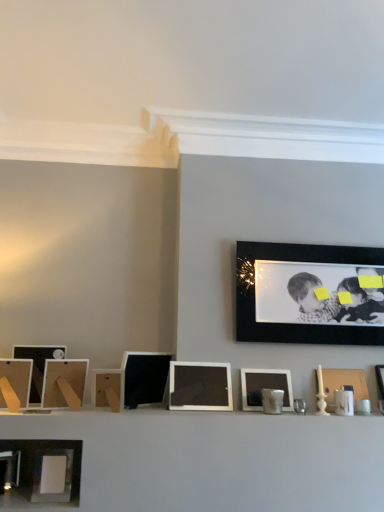
Question: Which direction should I rotate to look at matte black picture frame at center, placed as the 5th picture frame when sorted from left to right, — up or down?

Choices:
 (A) down
 (B) up

Answer: (A)

Question: Should I look upward or downward to see matte black picture frame at left, the 2th picture frame positioned from the left?

Choices:
 (A) up
 (B) down

Answer: (B)

Question: Is wooden picture frame at right, the ninth picture frame positioned from the left, to the right of wooden at center, arranged as the sixth picture frame when viewed from the right, from the viewer's perspective?

Choices:
 (A) yes
 (B) no

Answer: (A)

Question: Considering the relative sizes of wooden picture frame at right, the ninth picture frame positioned from the left, and wooden at center, arranged as the sixth picture frame when viewed from the right, in the image provided, is wooden picture frame at right, the ninth picture frame positioned from the left, shorter than wooden at center, arranged as the sixth picture frame when viewed from the right,?

Choices:
 (A) no
 (B) yes

Answer: (A)

Question: Does wooden picture frame at right, the ninth picture frame positioned from the left, have a smaller size compared to wooden at center, arranged as the sixth picture frame when viewed from the right?

Choices:
 (A) no
 (B) yes

Answer: (A)

Question: Is wooden at center, arranged as the sixth picture frame when viewed from the right, surrounded by wooden picture frame at right, the first picture frame from the right?

Choices:
 (A) no
 (B) yes

Answer: (A)

Question: From the image's perspective, is wooden picture frame at right, the first picture frame from the right, under wooden at center, which is the 4th picture frame from left to right?

Choices:
 (A) yes
 (B) no

Answer: (A)

Question: Can you confirm if wooden picture frame at right, the first picture frame from the right, is positioned to the left of wooden at center, arranged as the sixth picture frame when viewed from the right?

Choices:
 (A) yes
 (B) no

Answer: (B)

Question: Is matte black picture frame at center, the 6th picture frame when ordered from left to right, completely or partially inside black matte picture frame at upper right, the eighth picture frame viewed from the left?

Choices:
 (A) no
 (B) yes

Answer: (A)

Question: From a real-world perspective, is black matte picture frame at upper right, the 2th picture frame from the right, located higher than matte black picture frame at center, which appears as the 4th picture frame when viewed from the right?

Choices:
 (A) yes
 (B) no

Answer: (A)

Question: Is black matte picture frame at upper right, the 2th picture frame from the right, positioned beyond the bounds of matte black picture frame at center, which appears as the 4th picture frame when viewed from the right?

Choices:
 (A) no
 (B) yes

Answer: (B)

Question: From a real-world perspective, is black matte picture frame at upper right, the 2th picture frame from the right, under matte black picture frame at center, which appears as the 4th picture frame when viewed from the right?

Choices:
 (A) yes
 (B) no

Answer: (B)

Question: From the image's perspective, is black matte picture frame at upper right, the 2th picture frame from the right, below matte black picture frame at center, which appears as the 4th picture frame when viewed from the right?

Choices:
 (A) no
 (B) yes

Answer: (A)

Question: Can you confirm if black matte picture frame at upper right, the 2th picture frame from the right, is shorter than matte black picture frame at center, the 6th picture frame when ordered from left to right?

Choices:
 (A) no
 (B) yes

Answer: (A)

Question: Does matte wooden picture frame at left, which is the 7th picture frame from right to left, have a larger size compared to matte white picture frame at center, the third picture frame from the right?

Choices:
 (A) yes
 (B) no

Answer: (A)